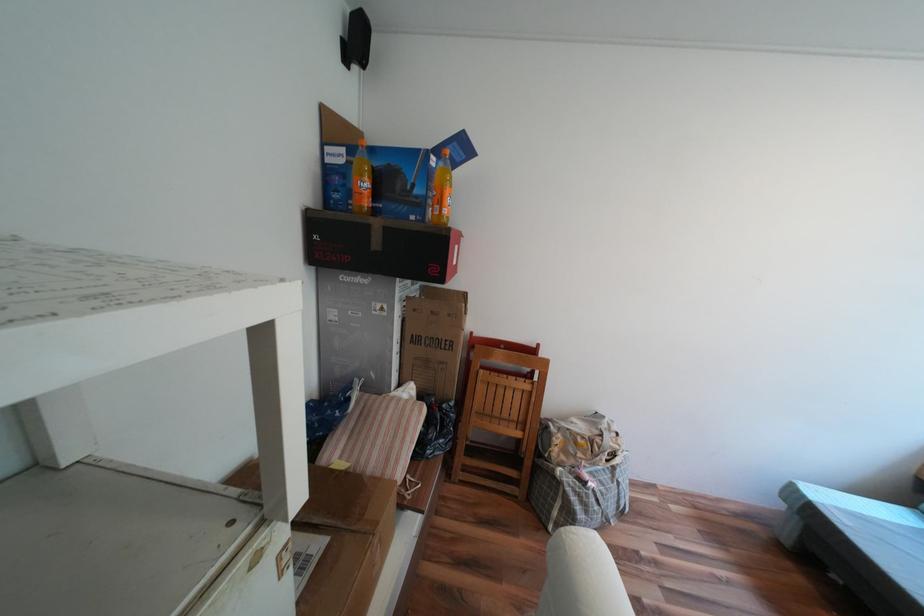
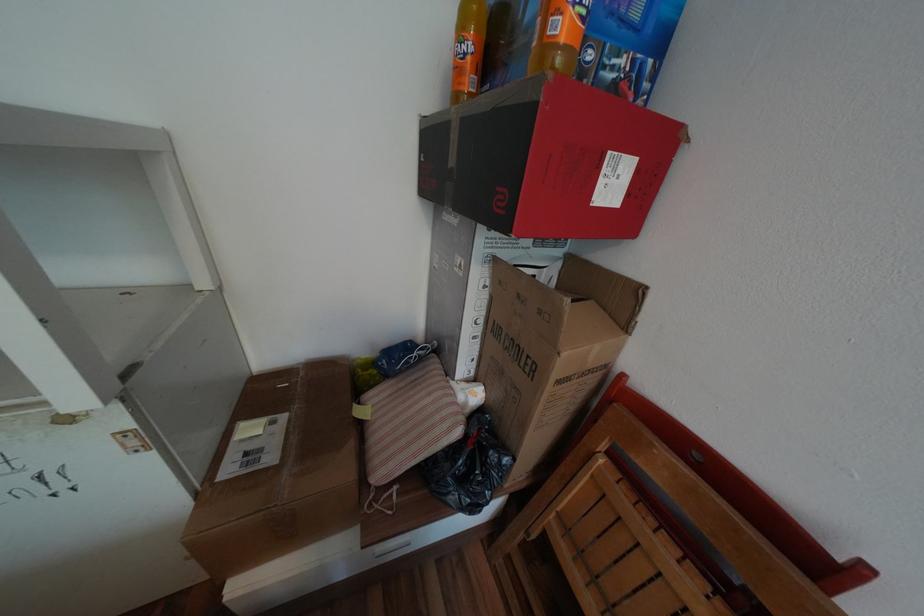
In the second image, find the point that corresponds to point 458,315 in the first image.

(550, 312)